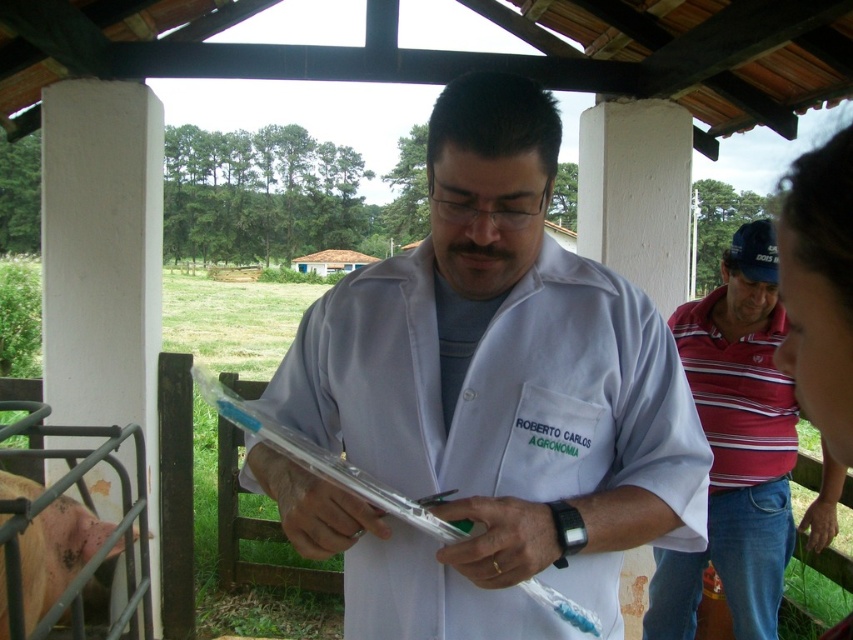
Question: Considering the real-world distances, which object is farthest from the striped cotton polo shirt at right?

Choices:
 (A) white lab coat at center
 (B) pinkish-brown skin at lower left

Answer: (B)

Question: Can you confirm if white lab coat at center is positioned to the left of pinkish-brown skin at lower left?

Choices:
 (A) no
 (B) yes

Answer: (A)

Question: Which point is closer to the camera?

Choices:
 (A) striped cotton polo shirt at right
 (B) pinkish-brown skin at lower left
 (C) white lab coat at center

Answer: (C)

Question: Which point is farther to the camera?

Choices:
 (A) white lab coat at center
 (B) striped cotton polo shirt at right
 (C) pinkish-brown skin at lower left

Answer: (B)

Question: Where is white lab coat at center located in relation to striped cotton polo shirt at right in the image?

Choices:
 (A) below
 (B) above

Answer: (B)

Question: Can you confirm if white lab coat at center is smaller than striped cotton polo shirt at right?

Choices:
 (A) yes
 (B) no

Answer: (A)